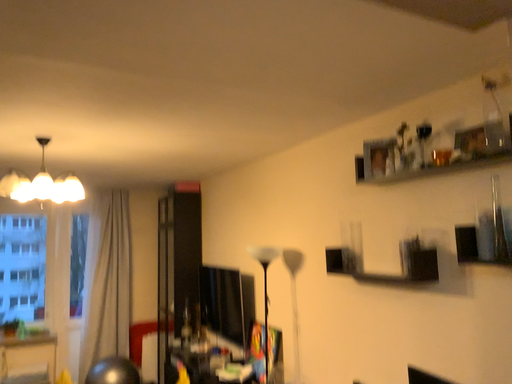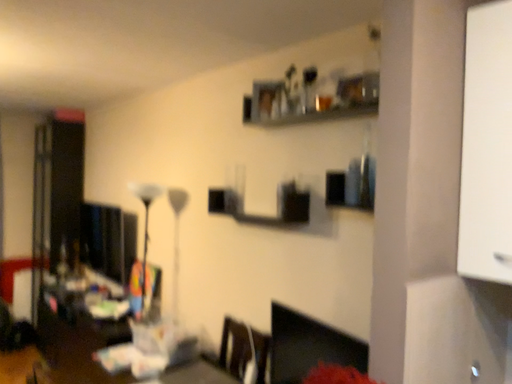
Question: Which way did the camera rotate in the video?

Choices:
 (A) rotated left
 (B) rotated right

Answer: (B)